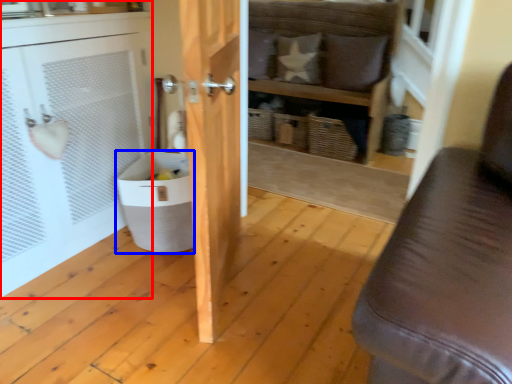
Question: Among these objects, which one is farthest to the camera, cabinetry (highlighted by a red box) or laundry basket (highlighted by a blue box)?

Choices:
 (A) cabinetry
 (B) laundry basket

Answer: (B)